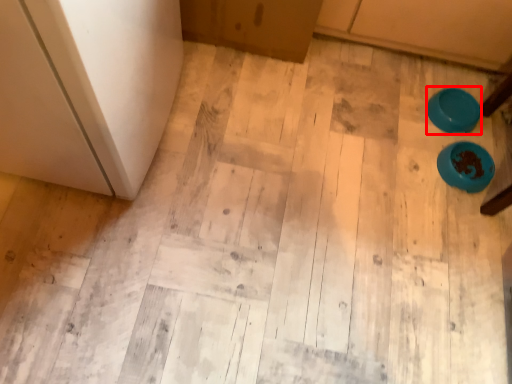
Question: Where is bowl (annotated by the red box) located in relation to bowl in the image?

Choices:
 (A) left
 (B) right

Answer: (A)